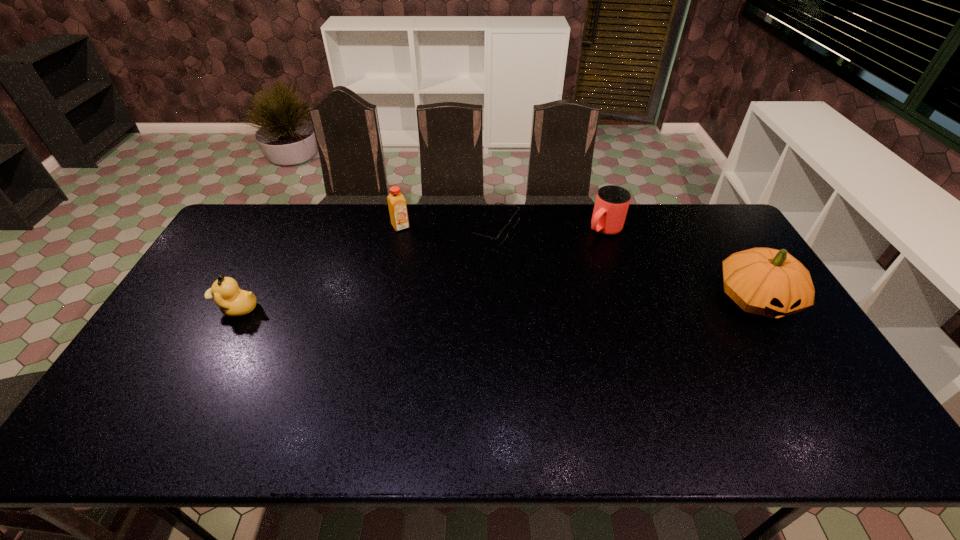
Identify the location of vacant spot on the desktop that is between the duckling and the gourd and is positioned with the lenses facing outward on the shortest object. (575, 302).

The image size is (960, 540). I want to click on free spot on the desktop that is between the duckling and the gourd and is positioned on the front and back of the second object from left to right, so click(461, 305).

This screenshot has width=960, height=540. I want to click on free spot on the desktop that is between the duckling and the tallest object and is positioned on the handle side of the cup, so click(x=516, y=303).